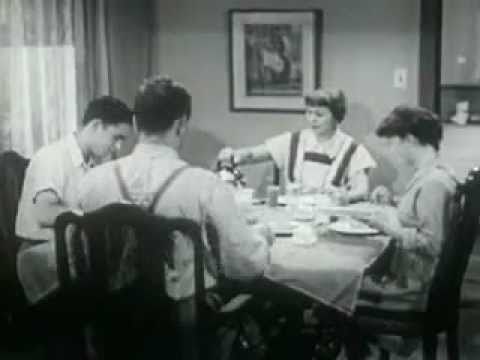
Where is `chair`? This screenshot has height=360, width=480. chair is located at coordinates (455, 277), (149, 230), (10, 160).